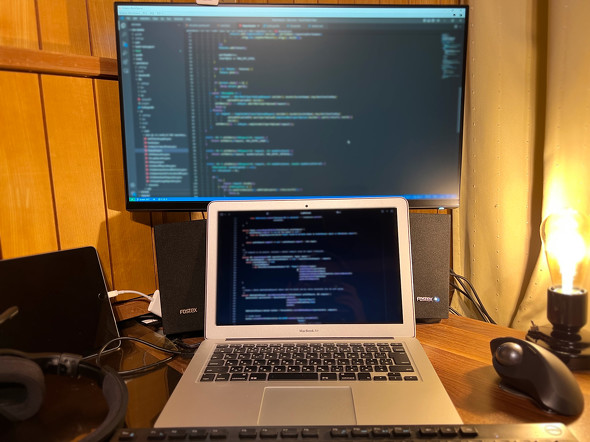
This screenshot has width=590, height=442. In order to click on laptop in this screenshot , I will do `click(359, 398)`.